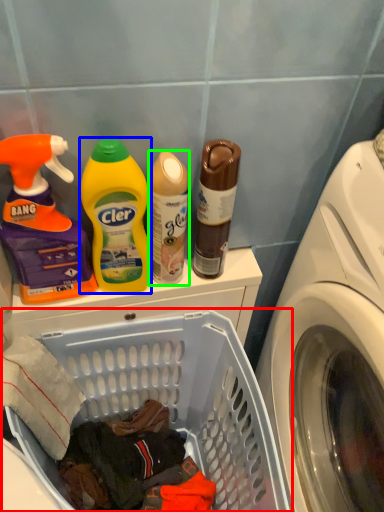
Question: Estimate the real-world distances between objects in this image. Which object is closer to laundry basket (highlighted by a red box), cleaning product (highlighted by a blue box) or cleaning product (highlighted by a green box)?

Choices:
 (A) cleaning product
 (B) cleaning product

Answer: (A)